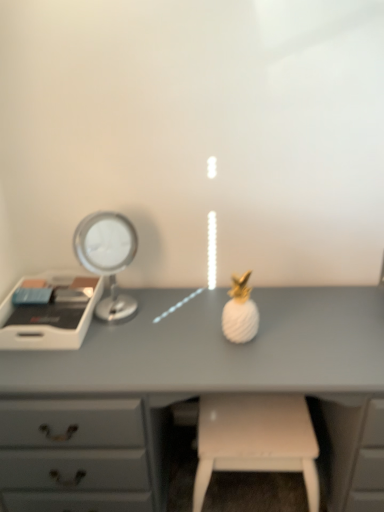
This screenshot has width=384, height=512. What are the coordinates of `free space between silver metallic mirror at left and white plastic tray at left` in the screenshot? It's located at (106, 303).